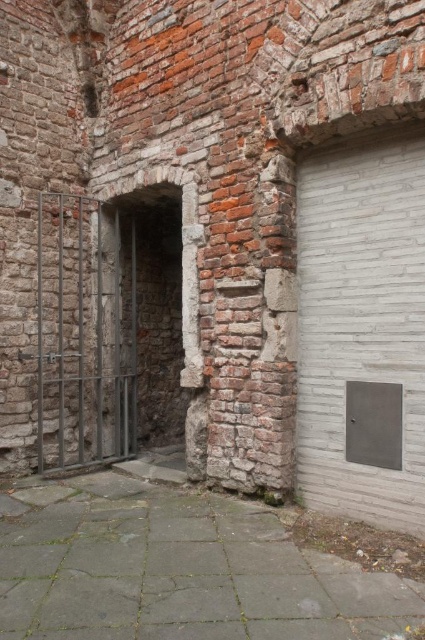
Question: Does gray concrete alley at center have a greater width compared to white matte garage door at right?

Choices:
 (A) yes
 (B) no

Answer: (A)

Question: Which object appears closest to the camera in this image?

Choices:
 (A) gray concrete alley at center
 (B) white matte garage door at right
 (C) metallic gate at left

Answer: (A)

Question: Which point is closer to the camera?

Choices:
 (A) (371, 317)
 (B) (405, 588)

Answer: (B)

Question: Which point is farther to the camera?

Choices:
 (A) metallic gate at left
 (B) white matte garage door at right

Answer: (A)

Question: Does white matte garage door at right appear over metallic gate at left?

Choices:
 (A) no
 (B) yes

Answer: (B)

Question: Is gray concrete alley at center bigger than metallic gate at left?

Choices:
 (A) no
 (B) yes

Answer: (A)